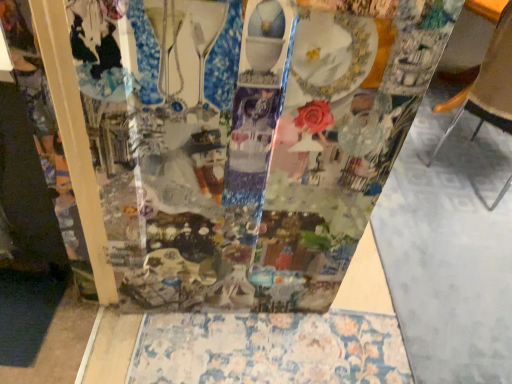
Image resolution: width=512 pixels, height=384 pixels. What do you see at coordinates (490, 84) in the screenshot?
I see `brown leather chair at right` at bounding box center [490, 84].

What do you see at coordinates (244, 140) in the screenshot? The image size is (512, 384). I see `transparent plastic collage at center` at bounding box center [244, 140].

Identify the location of brown leather chair at right. This screenshot has height=384, width=512. point(490,84).

Consider the image. Looking at their sizes, would you say transparent plastic collage at center is wider or thinner than brown leather chair at right?

transparent plastic collage at center is thinner than brown leather chair at right.

Between transparent plastic collage at center and brown leather chair at right, which one appears on the right side from the viewer's perspective?

From the viewer's perspective, brown leather chair at right appears more on the right side.

Is transparent plastic collage at center far from brown leather chair at right?

Yes, transparent plastic collage at center is far from brown leather chair at right.

From the image's perspective, which one is positioned lower, transparent plastic collage at center or brown leather chair at right?

transparent plastic collage at center is shown below in the image.

From the image's perspective, between brown leather chair at right and floral-patterned fabric at lower center, which one is located above?

brown leather chair at right, from the image's perspective.

Is brown leather chair at right aimed at floral-patterned fabric at lower center?

No, brown leather chair at right does not turn towards floral-patterned fabric at lower center.

Are brown leather chair at right and floral-patterned fabric at lower center located far from each other?

Yes, brown leather chair at right and floral-patterned fabric at lower center are located far from each other.

Is brown leather chair at right in front of or behind floral-patterned fabric at lower center in the image?

Visually, brown leather chair at right is located behind floral-patterned fabric at lower center.

Would you say transparent plastic collage at center is inside or outside floral-patterned fabric at lower center?

transparent plastic collage at center is outside floral-patterned fabric at lower center.

From a real-world perspective, which is physically below, transparent plastic collage at center or floral-patterned fabric at lower center?

floral-patterned fabric at lower center.

Which object is closer to the camera taking this photo, transparent plastic collage at center or floral-patterned fabric at lower center?

transparent plastic collage at center is in front.

Is transparent plastic collage at center facing away from floral-patterned fabric at lower center?

transparent plastic collage at center is not turned away from floral-patterned fabric at lower center.

Does floral-patterned fabric at lower center come behind transparent plastic collage at center?

Yes, floral-patterned fabric at lower center is behind transparent plastic collage at center.

In the scene shown: Is floral-patterned fabric at lower center taller or shorter than transparent plastic collage at center?

floral-patterned fabric at lower center is shorter than transparent plastic collage at center.

How far apart are floral-patterned fabric at lower center and transparent plastic collage at center?

The distance of floral-patterned fabric at lower center from transparent plastic collage at center is 18.90 inches.

Is point (202, 370) positioned behind point (145, 267)?

Yes, it is behind point (145, 267).

From the image's perspective, would you say brown leather chair at right is positioned over transparent plastic collage at center?

Indeed, from the image's perspective, brown leather chair at right is shown above transparent plastic collage at center.

At what (x,y) coordinates should I click in order to perform the action: click on glass box in front of the brown leather chair at right. Please return your answer as a coordinate pair (x, y). The width and height of the screenshot is (512, 384). Looking at the image, I should click on (244, 140).

Considering the positions of point (456, 115) and point (280, 295), is point (456, 115) closer or farther from the camera than point (280, 295)?

Clearly, point (456, 115) is more distant from the camera than point (280, 295).

Measure the distance between floral-patterned fabric at lower center and brown leather chair at right.

floral-patterned fabric at lower center and brown leather chair at right are 4.50 feet apart from each other.

Is floral-patterned fabric at lower center turned away from brown leather chair at right?

No, floral-patterned fabric at lower center is not facing the opposite direction of brown leather chair at right.

Consider the image. Relative to brown leather chair at right, is floral-patterned fabric at lower center in front or behind?

Clearly, floral-patterned fabric at lower center is in front of brown leather chair at right.

Identify the location of glass box on the left of brown leather chair at right. This screenshot has width=512, height=384. (244, 140).

Locate an element on the screen. furniture behind the floral-patterned fabric at lower center is located at coordinates (490, 84).

From the image, which object appears to be farther from transparent plastic collage at center, brown leather chair at right or floral-patterned fabric at lower center?

Among the two, brown leather chair at right is located further to transparent plastic collage at center.

Considering their positions, is transparent plastic collage at center positioned closer to brown leather chair at right than floral-patterned fabric at lower center?

transparent plastic collage at center is closer to brown leather chair at right.

When comparing their distances from floral-patterned fabric at lower center, does brown leather chair at right or transparent plastic collage at center seem closer?

transparent plastic collage at center is positioned closer to the anchor floral-patterned fabric at lower center.

Based on their spatial positions, is transparent plastic collage at center or brown leather chair at right further from floral-patterned fabric at lower center?

brown leather chair at right is further to floral-patterned fabric at lower center.

When comparing their distances from brown leather chair at right, does floral-patterned fabric at lower center or transparent plastic collage at center seem closer?

The object closer to brown leather chair at right is transparent plastic collage at center.

Looking at the image, which one is located further to transparent plastic collage at center, floral-patterned fabric at lower center or brown leather chair at right?

brown leather chair at right lies further to transparent plastic collage at center than the other object.

Where is `tablecloth located between transparent plastic collage at center and brown leather chair at right in the left-right direction`? tablecloth located between transparent plastic collage at center and brown leather chair at right in the left-right direction is located at coordinates 270,349.